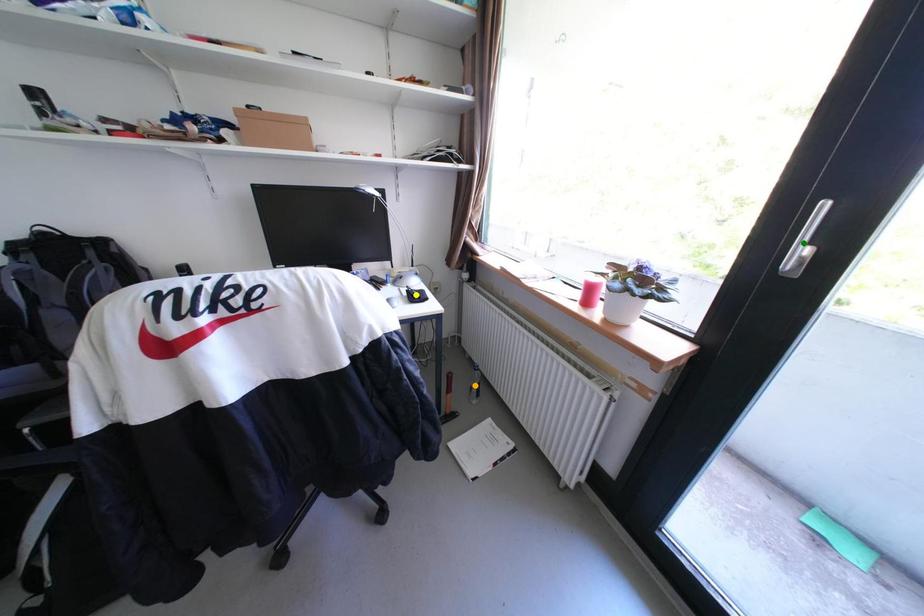
Order these from nearest to farthest:
1. orange point
2. yellow point
3. green point

orange point
yellow point
green point